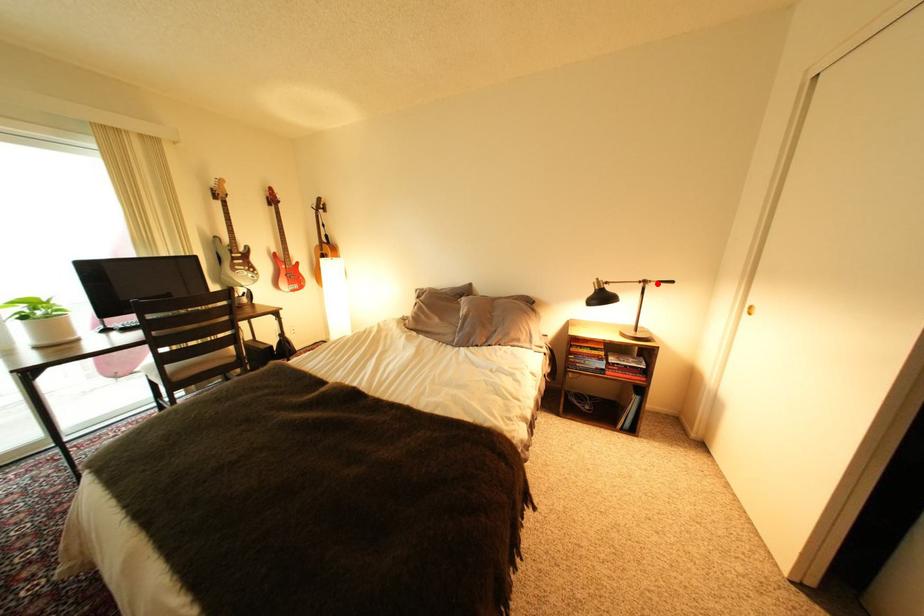
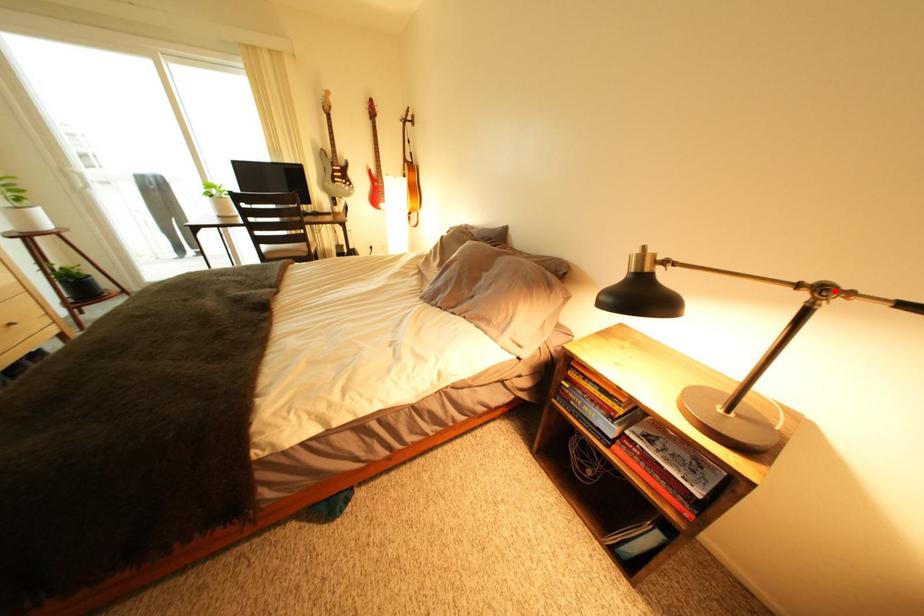
I am providing you with two images of the same scene from different viewpoints. A red point is marked on the first image and another point is marked on the second image. Is the red point in image1 aligned with the point shown in image2?

Yes